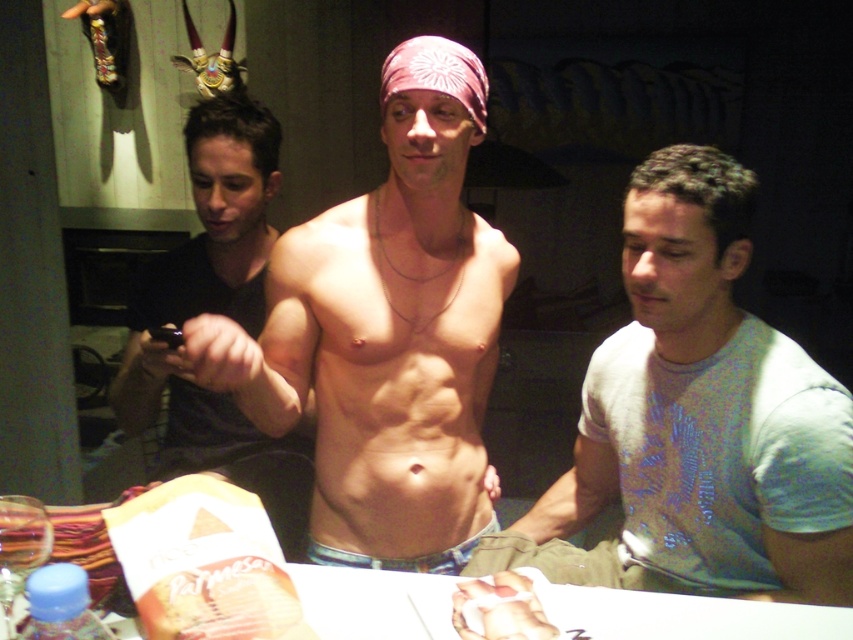
Consider the image. Can you confirm if pink fabric headband at center is positioned to the right of light blue cotton shirt at center?

No, pink fabric headband at center is not to the right of light blue cotton shirt at center.

The height and width of the screenshot is (640, 853). What do you see at coordinates (386, 333) in the screenshot?
I see `pink fabric headband at center` at bounding box center [386, 333].

You are a GUI agent. You are given a task and a screenshot of the screen. Output one action in this format:
    pyautogui.click(x=<x>, y=<y>)
    Task: Click on the pink fabric headband at center
    This screenshot has height=640, width=853.
    Given the screenshot: What is the action you would take?
    pyautogui.click(x=386, y=333)

Which of these two, light blue cotton shirt at center or white glossy table at center, stands shorter?

white glossy table at center

Does point (746, 221) lie in front of point (384, 604)?

No, it is behind (384, 604).

Where is `light blue cotton shirt at center`? light blue cotton shirt at center is located at coordinates (705, 412).

Who is more distant from viewer, (329, 497) or (259, 486)?

Positioned behind is point (259, 486).

Between point (242, 403) and point (142, 298), which one is positioned in front?

Point (242, 403) is more forward.

Identify the location of pink fabric headband at center. The width and height of the screenshot is (853, 640). (386, 333).